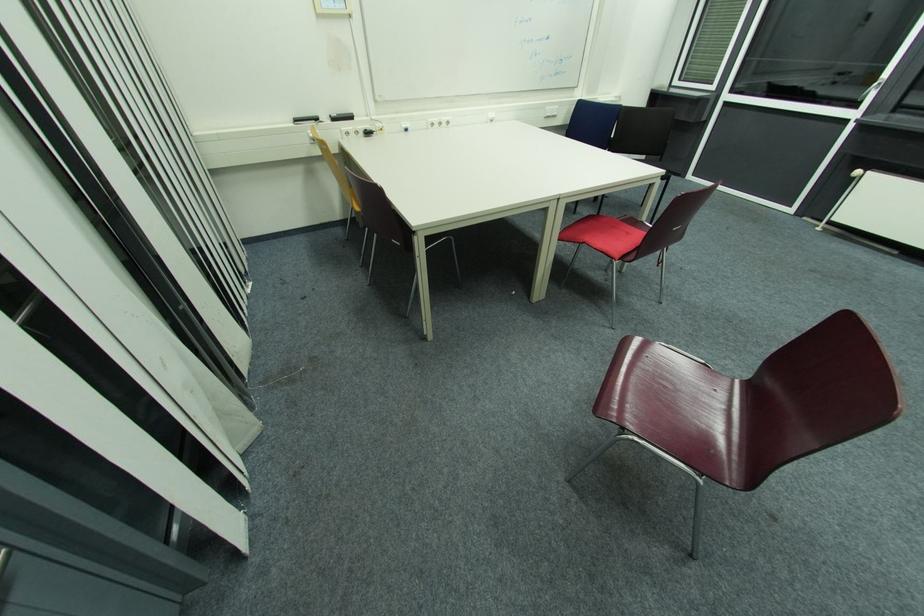
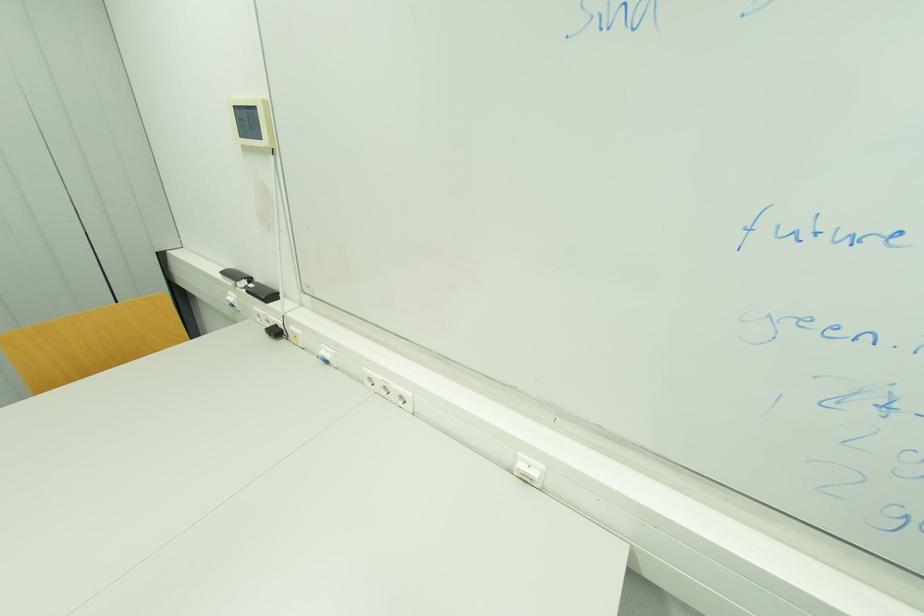
The point at [371,134] is marked in the first image. Where is the corresponding point in the second image?

(281, 333)